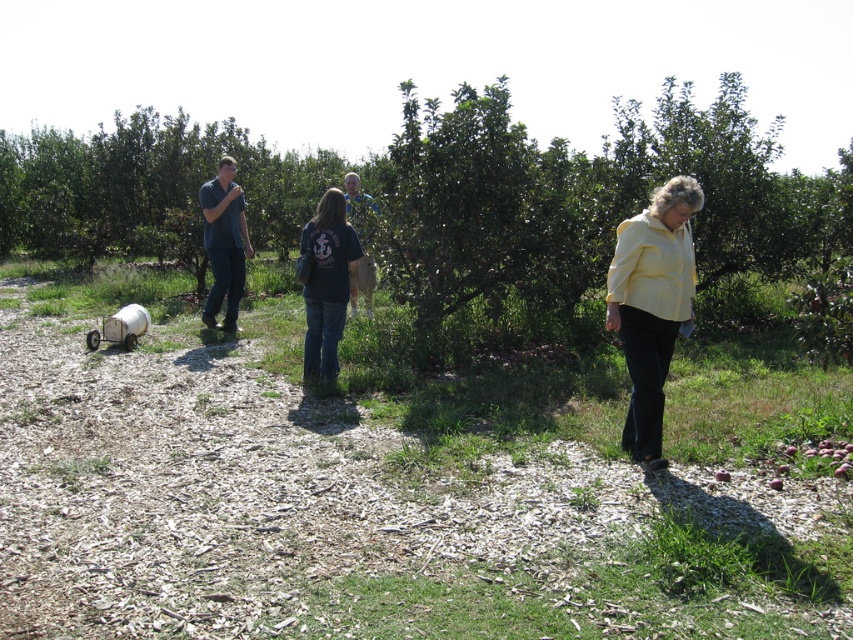
Between yellow matte shirt at center and black cotton shirt at center, which one appears on the right side from the viewer's perspective?

From the viewer's perspective, yellow matte shirt at center appears more on the right side.

Is yellow matte shirt at center above black cotton shirt at center?

Incorrect, yellow matte shirt at center is not positioned above black cotton shirt at center.

Is point (635, 326) less distant than point (315, 227)?

Yes.

At what (x,y) coordinates should I click in order to perform the action: click on yellow matte shirt at center. Please return your answer as a coordinate pair (x, y). This screenshot has height=640, width=853. Looking at the image, I should click on (651, 305).

Is green leafy tree at center above black cotton shirt at center?

Indeed, green leafy tree at center is positioned over black cotton shirt at center.

Is green leafy tree at center in front of black cotton shirt at center?

Yes, it is in front of black cotton shirt at center.

Find the location of a particular element. This screenshot has height=640, width=853. green leafy tree at center is located at coordinates (587, 198).

Between green leafy tree at center and blue denim jacket at center, which one appears on the right side from the viewer's perspective?

green leafy tree at center is more to the right.

Between point (409, 100) and point (352, 307), which one is positioned in front?

Point (352, 307) is more forward.

In order to click on green leafy tree at center in this screenshot , I will do `click(587, 198)`.